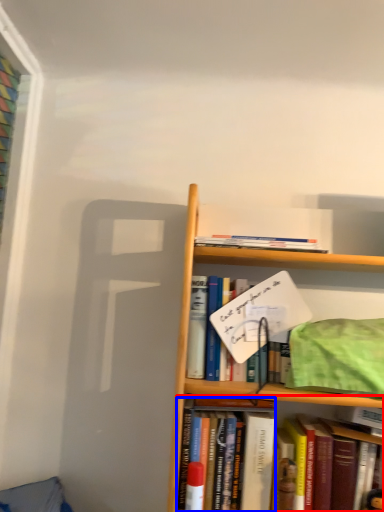
Question: Which of the following is the closest to the observer, book (highlighted by a red box) or book (highlighted by a blue box)?

Choices:
 (A) book
 (B) book

Answer: (A)